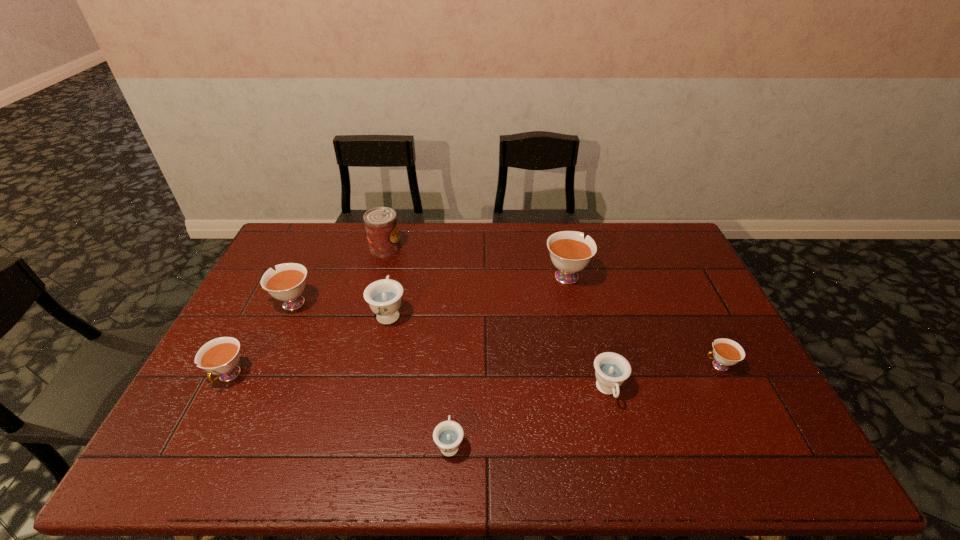
Image resolution: width=960 pixels, height=540 pixels. I want to click on vacant space positioned on the side of the third teacup from left to right with the handle, so click(399, 264).

This screenshot has height=540, width=960. I want to click on vacant space located on the side of the third biggest white teacup with the handle, so click(x=204, y=423).

Locate an element on the screen. This screenshot has height=540, width=960. free location located 0.330m on the side of the rightmost teacup with the handle is located at coordinates (582, 366).

The height and width of the screenshot is (540, 960). In order to click on vacant space located 0.260m on the side of the rightmost teacup with the handle in this screenshot , I will do `click(607, 366)`.

Locate an element on the screen. Image resolution: width=960 pixels, height=540 pixels. blank area located 0.290m on the side of the rightmost teacup with the handle is located at coordinates (596, 366).

Where is `vacant area located 0.350m on the side of the nearest object with the handle`? vacant area located 0.350m on the side of the nearest object with the handle is located at coordinates (456, 321).

This screenshot has height=540, width=960. What are the coordinates of `free region located 0.070m on the side of the nearest object with the handle` in the screenshot? It's located at (452, 401).

This screenshot has height=540, width=960. Find the location of `vacant region located 0.150m on the side of the nearest object with the handle`. vacant region located 0.150m on the side of the nearest object with the handle is located at coordinates (453, 376).

The width and height of the screenshot is (960, 540). I want to click on can at the far edge, so click(x=381, y=225).

You are a GUI agent. You are given a task and a screenshot of the screen. Output one action in this format:
    pyautogui.click(x=<x>, y=<y>)
    Task: Click on the teacup that is at the far edge
    The image size is (960, 540).
    Given the screenshot: What is the action you would take?
    pyautogui.click(x=570, y=253)